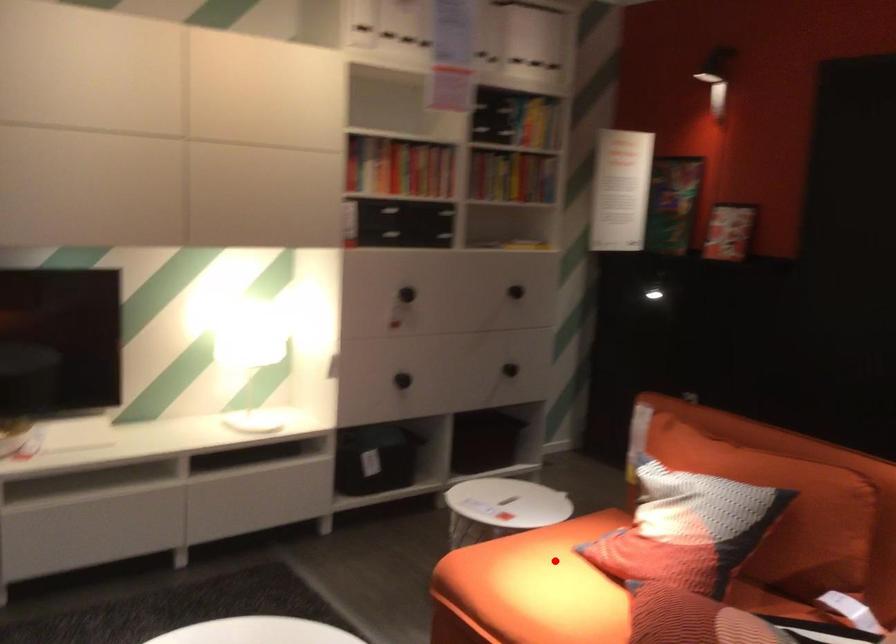
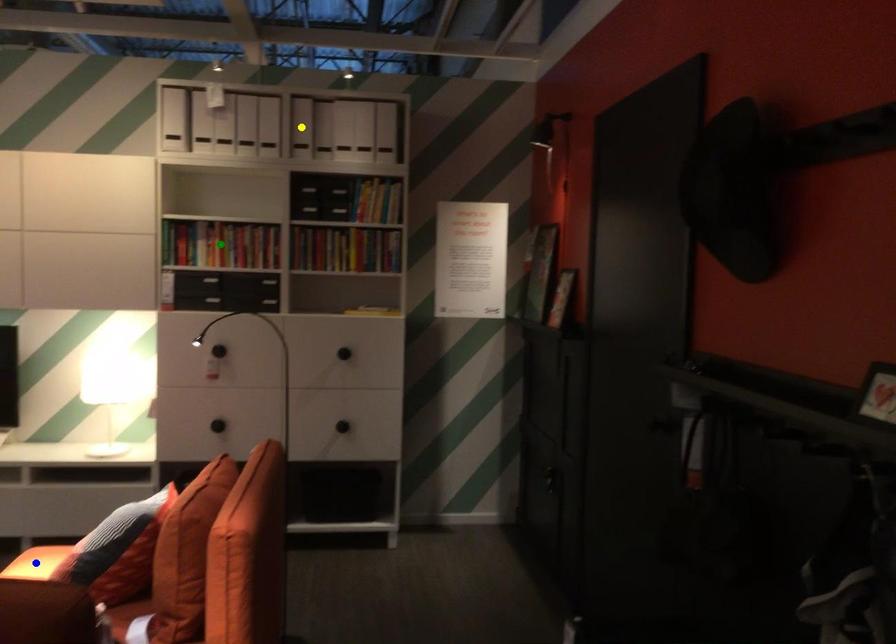
Question: I am providing you with two images of the same scene from different viewpoints. A red point is marked on the first image. You are given multiple points on the second image. Which spot in image 2 lines up with the point in image 1?

Choices:
 (A) yellow point
 (B) green point
 (C) blue point

Answer: (C)